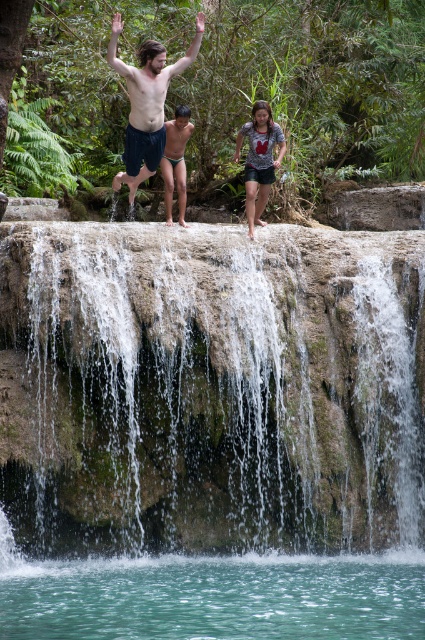
You are standing at the edge of the waterfall and want to place a safety sign at the point that is closer to you. Which point should you choose between point (297, 554) and point (141, 76)?

Point (297, 554) is closer to the viewer than point (141, 76), so you should choose point (297, 554) for placing the safety sign.

You are standing on the edge of the waterfall ledge and want to place a small decorative rock exactly at the point marked as point (x=209, y=388). What will be under your decorative rock once placed?

The green mossy rock at center will be under the decorative rock placed at point (x=209, y=388).